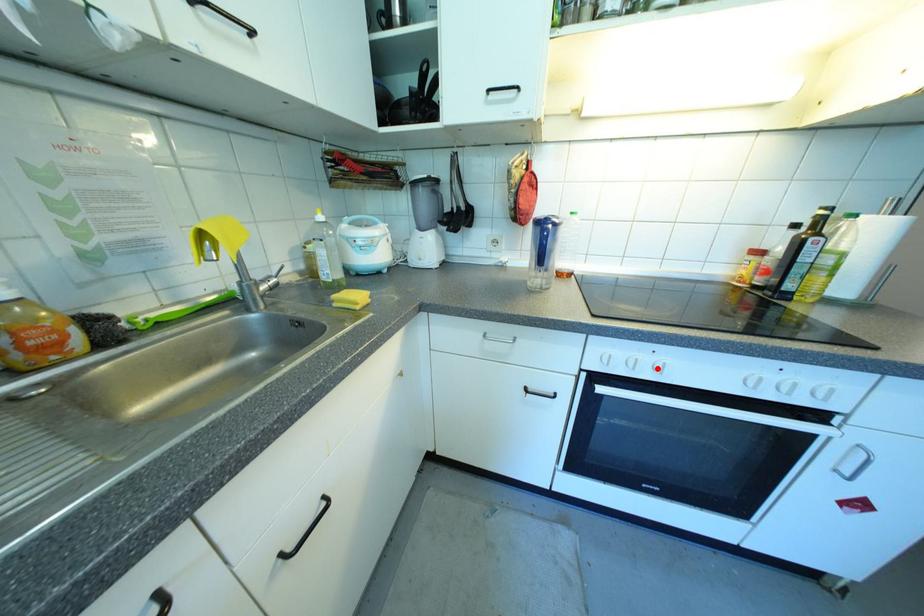
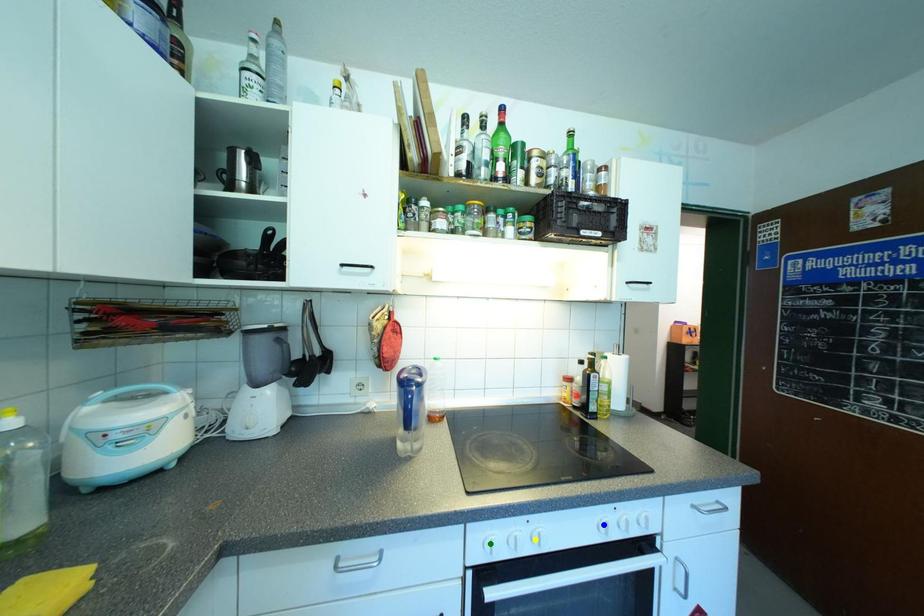
Question: I am providing you with two images of the same scene from different viewpoints. A red point is marked on the first image. You are given multiple points on the second image. In image 2, which mark is for the same physical point as the one in image 1?

Choices:
 (A) yellow point
 (B) green point
 (C) blue point

Answer: (A)